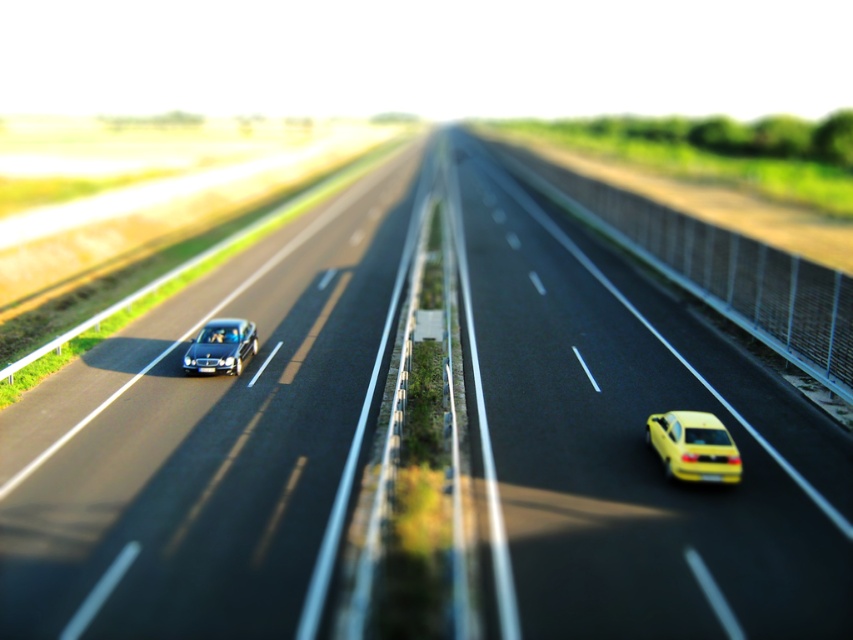
You are a drone operator trying to capture aerial footage of the highway. You need to fly your drone from point A to point B. Point A is at coordinates point (183, 298) and point B is at coordinates point (688, 452). Considering the highway scene described, which point is closer to the drone when it starts at point A?

Point A at coordinates point (183, 298) is closer to the drone when starting at point A since it is the starting position. However, according to the description, point (183, 298) is further to the viewer than point (688, 452). Wait, this seems contradictory. Let me clarify. The question asks which point is closer to the drone when it starts at point A. Since the drone is at point A initially, point A is at zero distance. However, if the question is about their relative positions in the scene, point 0.

You are a photographer trying to capture both the shiny metallic car at center and the shiny yellow car at right in a single frame. Given that your camera can only focus on objects wider than 2 meters, will both cars fit within the focus range?

The shiny metallic car at center has a larger width than the shiny yellow car at right. Since the camera requires objects wider than 2 meters to be in focus, and the metallic car is wider, it will likely be in focus. However, without knowing the exact widths, we can only confirm the metallic car meets the requirement.

You are a drone operator trying to capture aerial footage of the highway. Your drone can only fly within a 5 meter radius of the shiny metallic car at center. Can the drone safely capture footage of the yellow matte car at right without exceeding its operational range?

The shiny metallic car at center and yellow matte car at right are 6.40 meters apart. Since the drone can only operate within 5 meters of the shiny metallic car at center, it cannot safely capture footage of the yellow matte car at right without exceeding its operational range.